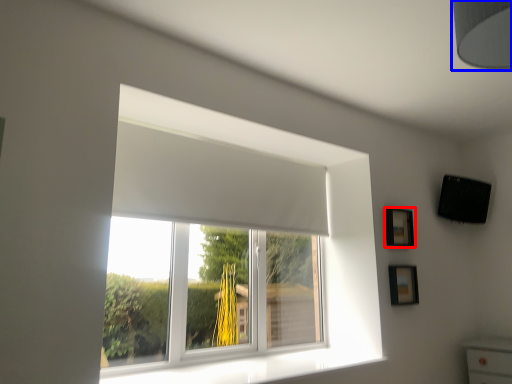
Question: Which object is closer to the camera taking this photo, picture frame (highlighted by a red box) or lamp (highlighted by a blue box)?

Choices:
 (A) picture frame
 (B) lamp

Answer: (B)